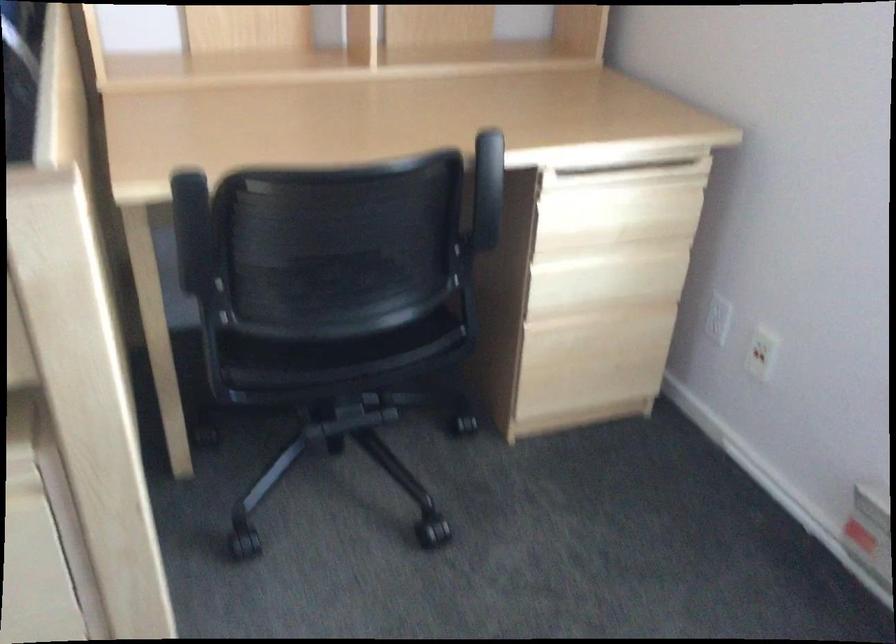
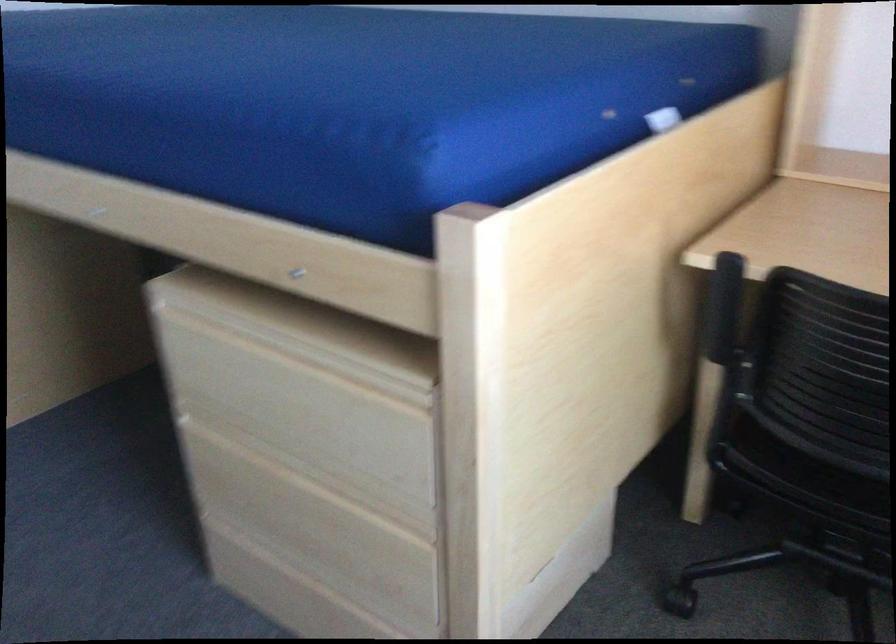
Question: The camera is either moving clockwise (left) or counter-clockwise (right) around the object. The first image is from the beginning of the video and the second image is from the end. Is the camera moving left or right when shooting the video?

Choices:
 (A) Left
 (B) Right

Answer: (B)